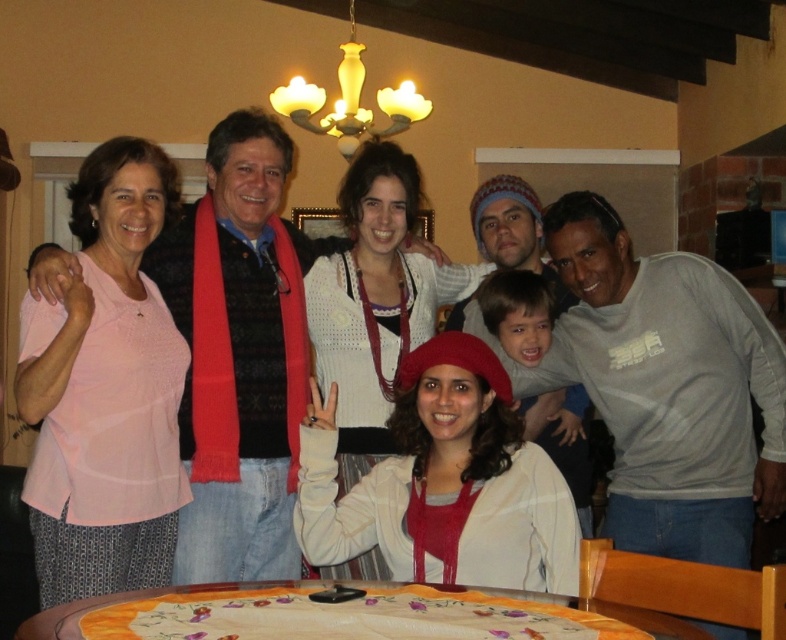
You are a photographer adjusting the camera focus. You need to ensure both the gray cotton shirt at center and the ivory matte chandelier at upper center are in focus. Which object should you focus on first to ensure depth of field covers both?

The gray cotton shirt at center is taller than the ivory matte chandelier at upper center, so focusing on the gray cotton shirt at center first will help ensure the depth of field includes both objects.

You are a photographer adjusting the camera angle to ensure both the pink fabric shirt at left and the embroidered fabric table at center are visible in the frame. Based on their positions, which object should you focus on first to capture both in the shot?

The photographer should focus on the embroidered fabric table at center first because the pink fabric shirt at left is above it, meaning the table is lower and within the same vertical plane, allowing both to be captured by adjusting the angle downward from the shirt towards the table.